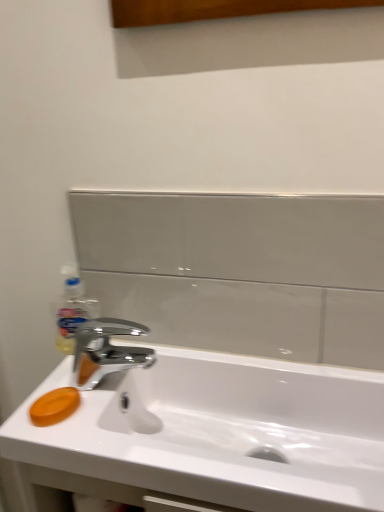
Where is `vacant space to the right of translucent plastic soap dispenser at left`? vacant space to the right of translucent plastic soap dispenser at left is located at coordinates (154, 353).